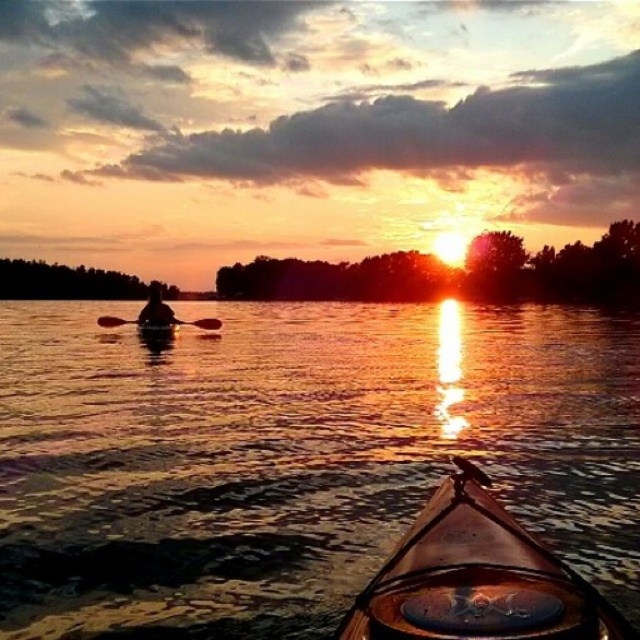
Between point (536, 332) and point (349, 616), which one is positioned in front?

Point (349, 616)

Is transparent plastic kayak at center to the right of wooden canoe at center from the viewer's perspective?

In fact, transparent plastic kayak at center is to the left of wooden canoe at center.

The height and width of the screenshot is (640, 640). I want to click on transparent plastic kayak at center, so click(x=294, y=456).

Where is `transparent plastic kayak at center`? The height and width of the screenshot is (640, 640). transparent plastic kayak at center is located at coordinates (294, 456).

Locate an element on the screen. The height and width of the screenshot is (640, 640). wooden canoe at center is located at coordinates (476, 579).

Between wooden canoe at center and silhouette wood person at center, which one has less height?

With less height is wooden canoe at center.

The image size is (640, 640). Describe the element at coordinates (476, 579) in the screenshot. I see `wooden canoe at center` at that location.

The height and width of the screenshot is (640, 640). I want to click on wooden canoe at center, so click(x=476, y=579).

You are a GUI agent. You are given a task and a screenshot of the screen. Output one action in this format:
    pyautogui.click(x=<x>, y=<y>)
    Task: Click on the wooden canoe at center
    The height and width of the screenshot is (640, 640).
    Given the screenshot: What is the action you would take?
    pyautogui.click(x=476, y=579)

In order to click on wooden canoe at center in this screenshot , I will do `click(476, 579)`.